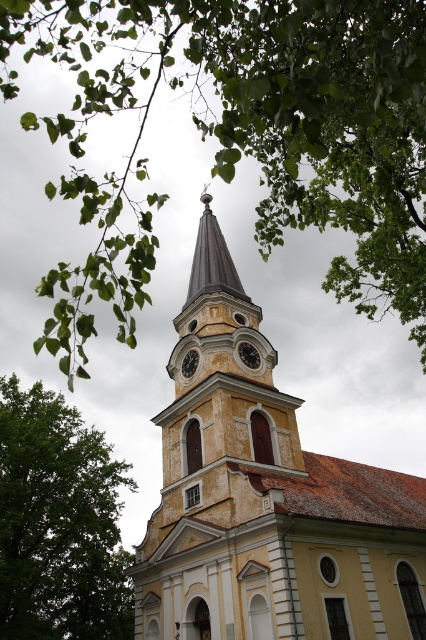
Question: Which point appears farthest from the camera in this image?

Choices:
 (A) (89, 552)
 (B) (181, 368)

Answer: (A)

Question: Is green leafy branch at upper center to the right of yellow weathered steeple at center from the viewer's perspective?

Choices:
 (A) no
 (B) yes

Answer: (A)

Question: Is yellow weathered steeple at center bigger than green leafy tree at left?

Choices:
 (A) yes
 (B) no

Answer: (A)

Question: Does dark gray metallic clock at center appear on the left side of metallic clock face at center?

Choices:
 (A) yes
 (B) no

Answer: (B)

Question: Which of the following is the closest to the observer?

Choices:
 (A) metallic clock face at center
 (B) green leafy branch at upper center
 (C) green leafy tree at left
 (D) dark gray metallic clock at center

Answer: (B)

Question: Based on their relative distances, which object is farther from the yellow weathered steeple at center?

Choices:
 (A) green leafy tree at left
 (B) dark gray metallic clock at center
 (C) green leafy branch at upper center

Answer: (C)